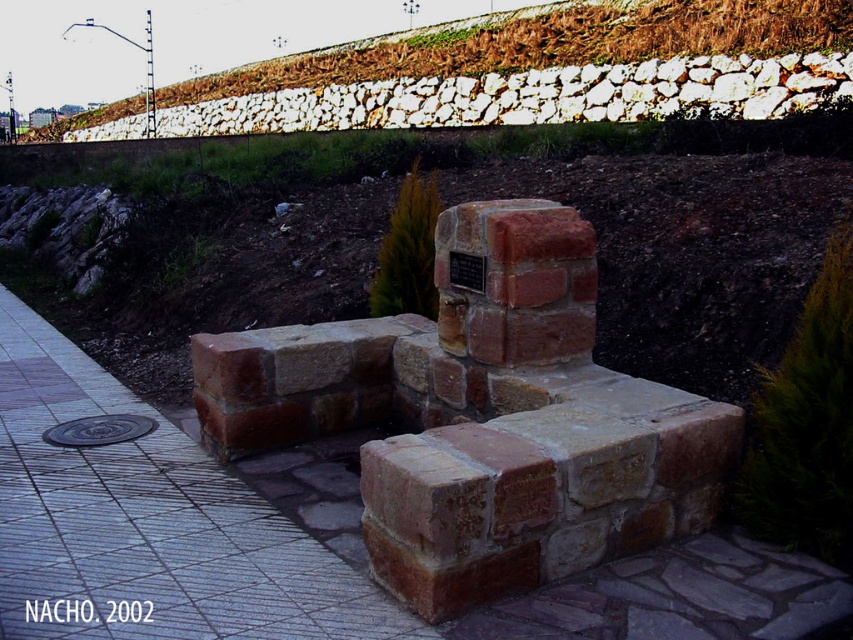
Looking at this image, does brown stone pavement at center have a smaller size compared to white stone wall at upper center?

Indeed, brown stone pavement at center has a smaller size compared to white stone wall at upper center.

Is point (171, 429) positioned behind point (593, 12)?

No, it is in front of (593, 12).

The width and height of the screenshot is (853, 640). What do you see at coordinates (296, 540) in the screenshot?
I see `brown stone pavement at center` at bounding box center [296, 540].

Where is `brown stone pavement at center`? Image resolution: width=853 pixels, height=640 pixels. brown stone pavement at center is located at coordinates (296, 540).